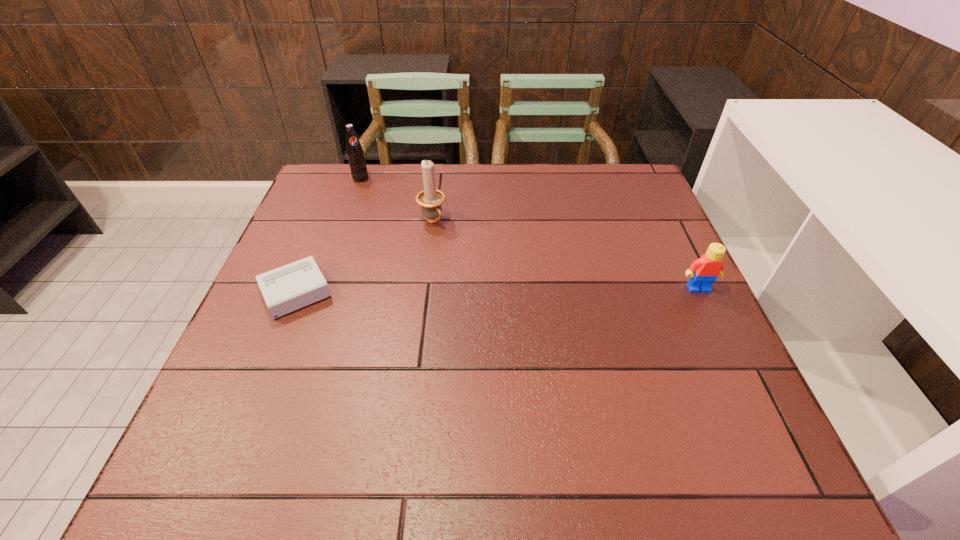
Where is `free space on the desktop that is between the alarm clock and the Lego and is positioned on the front label of the farthest object`? The image size is (960, 540). free space on the desktop that is between the alarm clock and the Lego and is positioned on the front label of the farthest object is located at coordinates (457, 290).

Where is `free spot on the desktop that is between the alarm clock and the Lego and is positioned on the handle side of the third object from left to right`? The image size is (960, 540). free spot on the desktop that is between the alarm clock and the Lego and is positioned on the handle side of the third object from left to right is located at coordinates (486, 289).